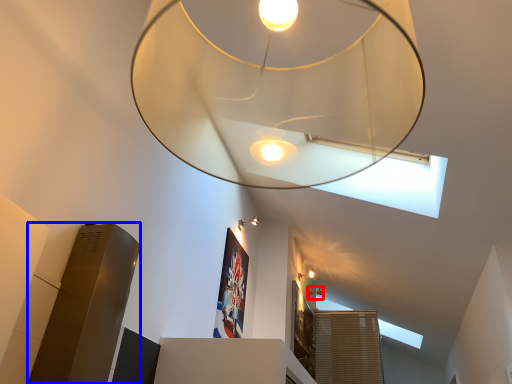
Question: Which point is closer to the camera, lamp (highlighted by a red box) or lift (highlighted by a blue box)?

Choices:
 (A) lamp
 (B) lift

Answer: (B)